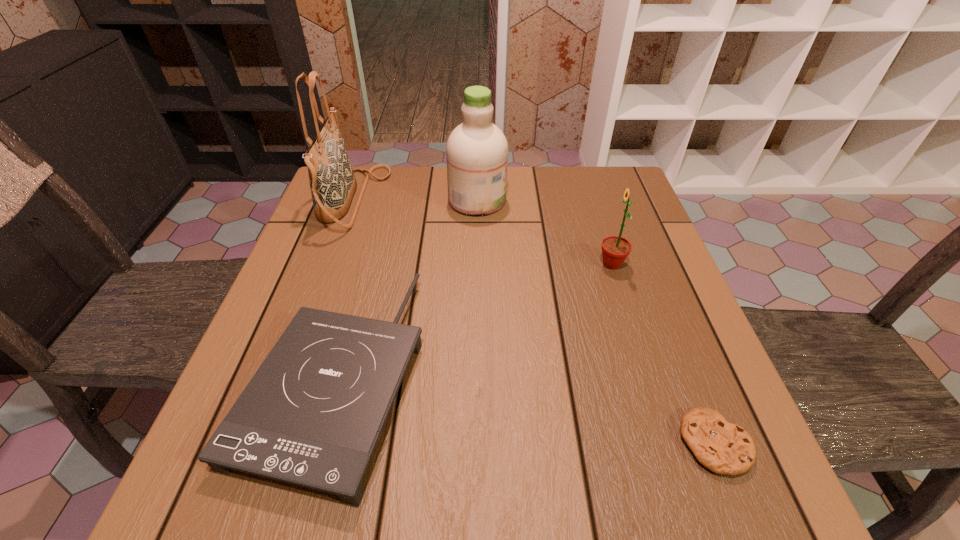
Identify the location of free location located on the face of the sunflower. The height and width of the screenshot is (540, 960). (559, 264).

At what (x,y) coordinates should I click in order to perform the action: click on free spot located on the right of the hotplate. Please return your answer as a coordinate pair (x, y). This screenshot has width=960, height=540. Looking at the image, I should click on (540, 375).

Identify the location of free space located on the left of the shortest object. The width and height of the screenshot is (960, 540). pos(558,443).

Locate an element on the screen. The height and width of the screenshot is (540, 960). handbag located at the far edge is located at coordinates (332, 181).

You are a GUI agent. You are given a task and a screenshot of the screen. Output one action in this format:
    pyautogui.click(x=<x>, y=<y>)
    Task: Click on the cleansing agent that is at the far edge
    The width and height of the screenshot is (960, 540).
    Given the screenshot: What is the action you would take?
    pyautogui.click(x=477, y=150)

Locate an element on the screen. hotplate located at the near edge is located at coordinates (312, 414).

Where is `cookie present at the near edge`? This screenshot has width=960, height=540. cookie present at the near edge is located at coordinates (724, 448).

The width and height of the screenshot is (960, 540). What are the coordinates of `handbag located in the left edge section of the desktop` in the screenshot? It's located at (332, 181).

At what (x,y) coordinates should I click in order to perform the action: click on hotplate positioned at the left edge. Please return your answer as a coordinate pair (x, y). The image size is (960, 540). Looking at the image, I should click on (312, 414).

Find the location of `sunflower situated at the right edge`. sunflower situated at the right edge is located at coordinates (615, 249).